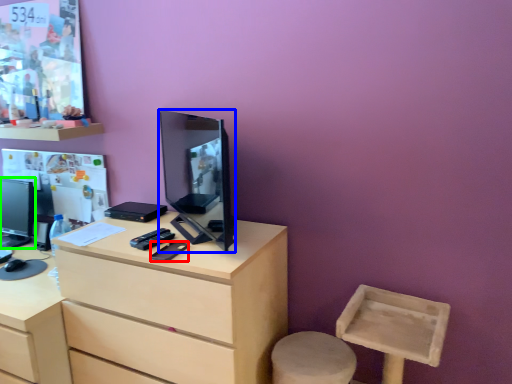
Question: Which is farther away from mobile phone (highlighted by a red box)? television (highlighted by a blue box) or television (highlighted by a green box)?

Choices:
 (A) television
 (B) television

Answer: (B)